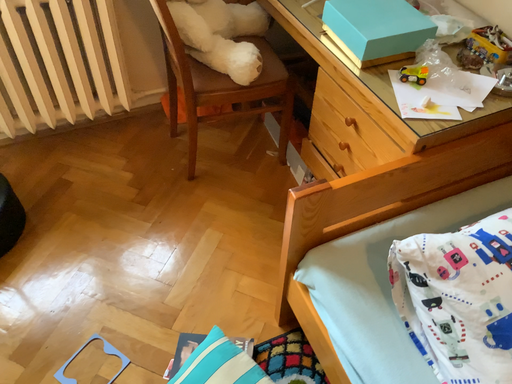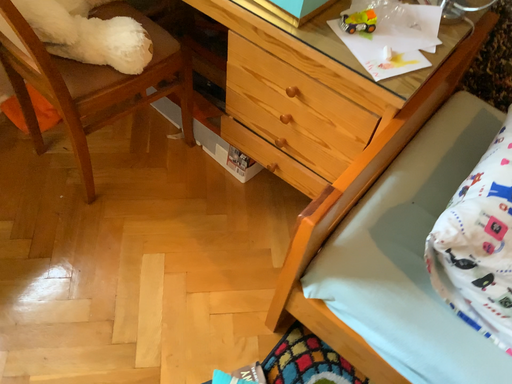
Question: How did the camera likely rotate when shooting the video?

Choices:
 (A) rotated left
 (B) rotated right

Answer: (B)